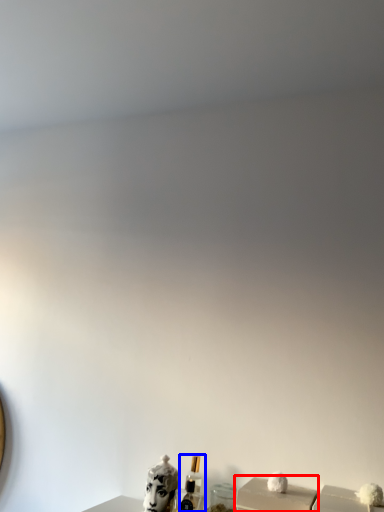
Question: Which of the following is the closest to the observer, box (highlighted by a red box) or perfume (highlighted by a blue box)?

Choices:
 (A) box
 (B) perfume

Answer: (A)